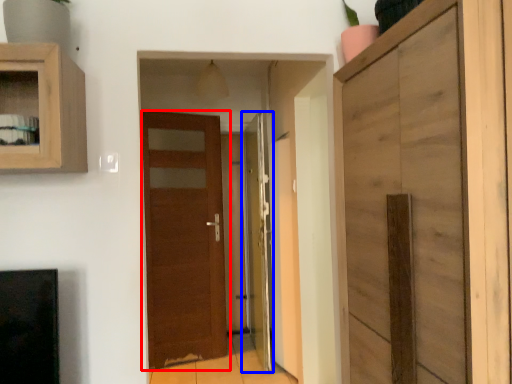
Question: Which object appears closest to the camera in this image, door (highlighted by a red box) or door (highlighted by a blue box)?

Choices:
 (A) door
 (B) door

Answer: (B)